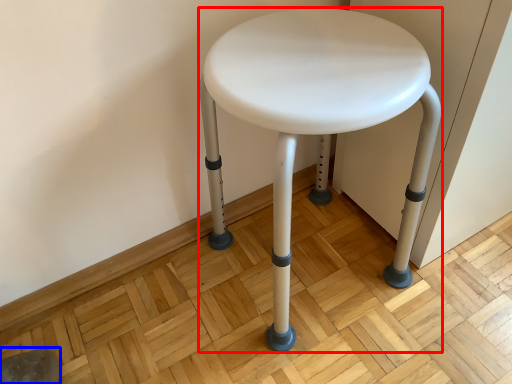
Question: Which of the following is the closest to the observer, stool (highlighted by a red box) or swivel chair (highlighted by a blue box)?

Choices:
 (A) stool
 (B) swivel chair

Answer: (A)